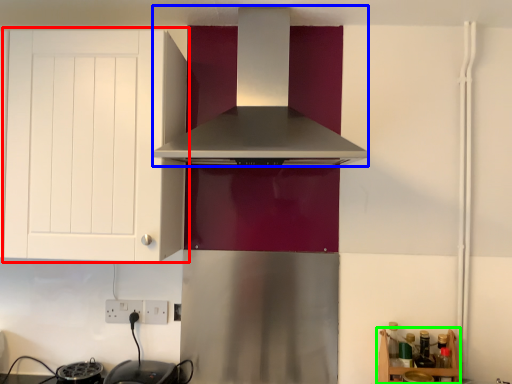
Question: Considering the real-world distances, which object is closest to cabinetry (highlighted by a red box)? home appliance (highlighted by a blue box) or shelf (highlighted by a green box).

Choices:
 (A) home appliance
 (B) shelf

Answer: (A)